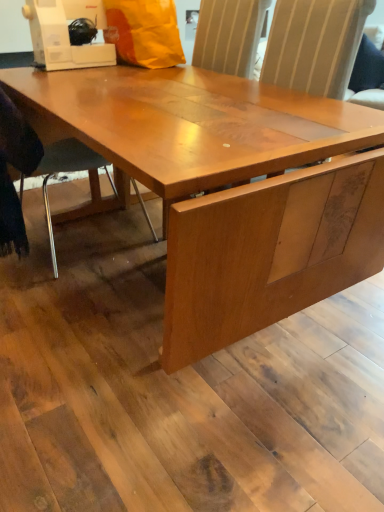
Image resolution: width=384 pixels, height=512 pixels. In order to click on vacant location below white plastic sewing machine at upper left (from a real-world perspective) in this screenshot , I will do `click(81, 200)`.